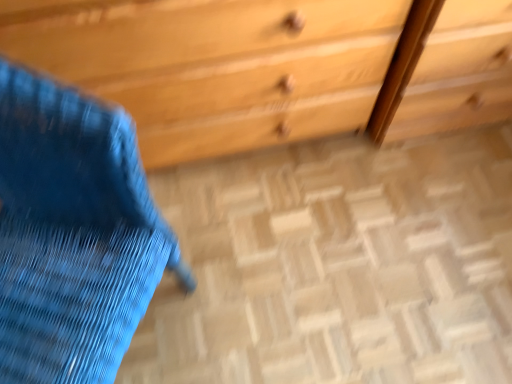
You are a GUI agent. You are given a task and a screenshot of the screen. Output one action in this format:
    pyautogui.click(x=<x>, y=<y>)
    Task: Click on the wooden floor at center
    The height and width of the screenshot is (384, 512).
    Given the screenshot: What is the action you would take?
    pyautogui.click(x=337, y=266)

What do you see at coordinates (273, 66) in the screenshot?
I see `wooden chest of drawers at upper center` at bounding box center [273, 66].

Measure the distance between wooden chest of drawers at upper center and camera.

They are 26.67 inches apart.

Find the location of a particular element. blue fabric swivel chair at left is located at coordinates (73, 234).

Is wooden chest of drawers at upper center wider or thinner than blue fabric swivel chair at left?

Clearly, wooden chest of drawers at upper center has less width compared to blue fabric swivel chair at left.

Does wooden chest of drawers at upper center turn towards blue fabric swivel chair at left?

Yes, wooden chest of drawers at upper center is oriented towards blue fabric swivel chair at left.

How far apart are wooden chest of drawers at upper center and blue fabric swivel chair at left?

wooden chest of drawers at upper center is 41.07 centimeters away from blue fabric swivel chair at left.

Is wooden chest of drawers at upper center completely or partially outside of blue fabric swivel chair at left?

Indeed, wooden chest of drawers at upper center is completely outside blue fabric swivel chair at left.

Which is behind, blue fabric swivel chair at left or wooden floor at center?

Positioned behind is wooden floor at center.

From the image's perspective, which is below, blue fabric swivel chair at left or wooden floor at center?

From the image's view, wooden floor at center is below.

Which object is positioned more to the right, blue fabric swivel chair at left or wooden floor at center?

wooden floor at center.

Is blue fabric swivel chair at left facing towards wooden floor at center?

No, blue fabric swivel chair at left is not facing towards wooden floor at center.

In terms of height, does wooden chest of drawers at upper center look taller or shorter compared to wooden floor at center?

wooden chest of drawers at upper center is taller than wooden floor at center.

From a real-world perspective, is wooden chest of drawers at upper center beneath wooden floor at center?

No.

Image resolution: width=512 pixels, height=384 pixels. Find the location of `chest of drawers on the left side of wooden floor at center`. chest of drawers on the left side of wooden floor at center is located at coordinates (273, 66).

From the image's perspective, which one is positioned lower, wooden chest of drawers at upper center or wooden floor at center?

wooden floor at center.

From a real-world perspective, is blue fabric swivel chair at left positioned over wooden chest of drawers at upper center based on gravity?

Yes, from a real-world perspective, blue fabric swivel chair at left is over wooden chest of drawers at upper center

Considering the positions of objects blue fabric swivel chair at left and wooden chest of drawers at upper center in the image provided, who is in front, blue fabric swivel chair at left or wooden chest of drawers at upper center?

Positioned in front is blue fabric swivel chair at left.

From the picture: Is blue fabric swivel chair at left bigger than wooden chest of drawers at upper center?

No, blue fabric swivel chair at left is not bigger than wooden chest of drawers at upper center.

Is blue fabric swivel chair at left to the right of wooden chest of drawers at upper center from the viewer's perspective?

In fact, blue fabric swivel chair at left is to the left of wooden chest of drawers at upper center.

Is wooden floor at center shorter than blue fabric swivel chair at left?

Yes, wooden floor at center is shorter than blue fabric swivel chair at left.

Which is more to the right, wooden floor at center or blue fabric swivel chair at left?

wooden floor at center is more to the right.

Who is smaller, wooden floor at center or blue fabric swivel chair at left?

wooden floor at center is smaller.

From the image's perspective, is wooden floor at center beneath blue fabric swivel chair at left?

Yes, from the image's perspective, wooden floor at center is beneath blue fabric swivel chair at left.

Who is shorter, wooden floor at center or wooden chest of drawers at upper center?

With less height is wooden floor at center.

Which of these two, wooden floor at center or wooden chest of drawers at upper center, is smaller?

wooden floor at center.

Is point (493, 240) farther from viewer compared to point (234, 150)?

No, it is in front of (234, 150).

Relative to wooden chest of drawers at upper center, is wooden floor at center in front or behind?

Clearly, wooden floor at center is behind wooden chest of drawers at upper center.

I want to click on swivel chair below the wooden chest of drawers at upper center (from the image's perspective), so click(x=73, y=234).

The width and height of the screenshot is (512, 384). I want to click on swivel chair to the left of wooden floor at center, so click(x=73, y=234).

When comparing their distances from wooden floor at center, does wooden chest of drawers at upper center or blue fabric swivel chair at left seem further?

Based on the image, blue fabric swivel chair at left appears to be further to wooden floor at center.

Looking at the image, which one is located further to wooden chest of drawers at upper center, blue fabric swivel chair at left or wooden floor at center?

blue fabric swivel chair at left is positioned further to the anchor wooden chest of drawers at upper center.

Which object lies nearer to the anchor point blue fabric swivel chair at left, wooden floor at center or wooden chest of drawers at upper center?

wooden chest of drawers at upper center is positioned closer to the anchor blue fabric swivel chair at left.

From the image, which object appears to be farther from blue fabric swivel chair at left, wooden chest of drawers at upper center or wooden floor at center?

The object further to blue fabric swivel chair at left is wooden floor at center.

Estimate the real-world distances between objects in this image. Which object is further from wooden floor at center, blue fabric swivel chair at left or wooden chest of drawers at upper center?

Among the two, blue fabric swivel chair at left is located further to wooden floor at center.

Which object lies nearer to the anchor point wooden chest of drawers at upper center, wooden floor at center or blue fabric swivel chair at left?

wooden floor at center is closer to wooden chest of drawers at upper center.

At what (x,y) coordinates should I click in order to perform the action: click on chest of drawers between blue fabric swivel chair at left and wooden floor at center. Please return your answer as a coordinate pair (x, y). The width and height of the screenshot is (512, 384). Looking at the image, I should click on click(x=273, y=66).